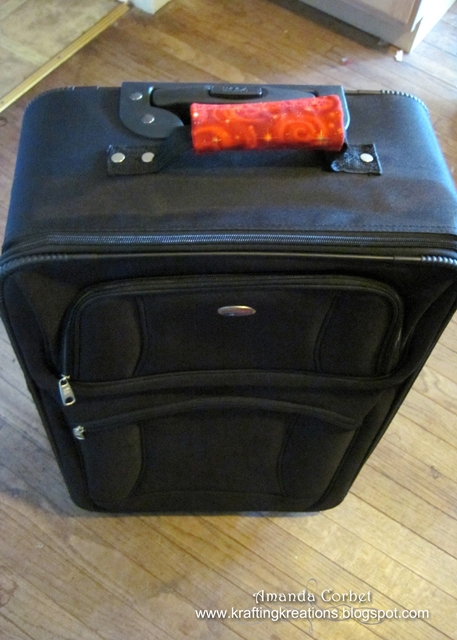
This screenshot has height=640, width=457. In order to click on floor in this screenshot , I will do 225,58.